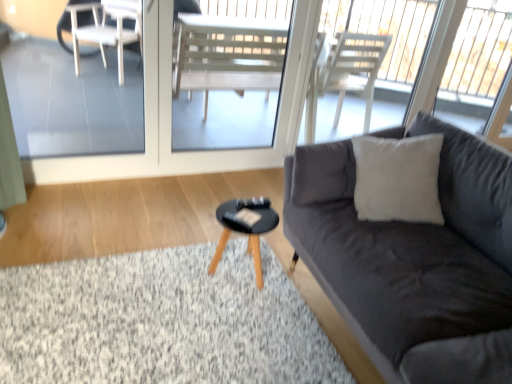
What are the coordinates of `free area below soft gray carpet at lower left (from a real-world perspective)` in the screenshot? It's located at (167, 321).